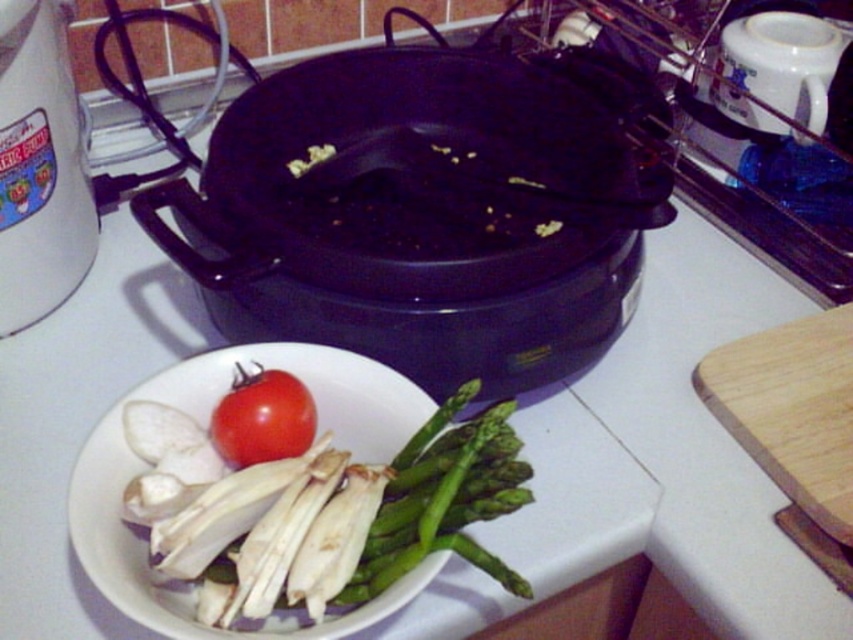
Question: Is black glossy frying pan at upper center further to camera compared to white glossy bowl at lower left?

Choices:
 (A) no
 (B) yes

Answer: (B)

Question: Which object is farther from the camera taking this photo?

Choices:
 (A) white glossy bowl at lower left
 (B) green smooth asparagus at lower left

Answer: (B)

Question: Among these objects, which one is nearest to the camera?

Choices:
 (A) green smooth asparagus at lower left
 (B) white glossy bowl at lower left

Answer: (B)

Question: Which of the following is the closest to the observer?

Choices:
 (A) (228, 404)
 (B) (448, 532)
 (C) (376, 364)

Answer: (B)

Question: Is white glossy bowl at lower left positioned at the back of white plastic kettle at lower left?

Choices:
 (A) yes
 (B) no

Answer: (B)

Question: Can you confirm if black glossy frying pan at upper center is bigger than white plastic kettle at lower left?

Choices:
 (A) yes
 (B) no

Answer: (A)